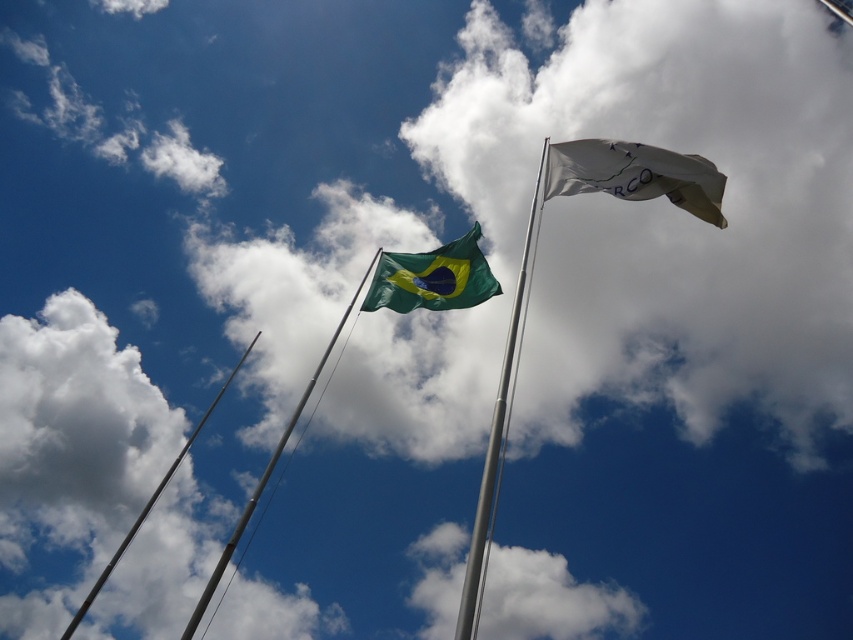
Question: Does white fabric flag at upper right appear over green fabric flag at center?

Choices:
 (A) no
 (B) yes

Answer: (B)

Question: Which is nearer to the metallic silver flag pole at upper center?

Choices:
 (A) white fabric flag at upper right
 (B) green fabric flag pole at upper center
 (C) green fabric flag at center
 (D) silver metallic flag pole at center

Answer: (B)

Question: Which of these objects is positioned closest to the green fabric flag pole at upper center?

Choices:
 (A) silver metallic flag pole at center
 (B) metallic silver flag pole at upper center

Answer: (B)

Question: Does green fabric flag at center appear on the right side of silver metallic flag pole at center?

Choices:
 (A) no
 (B) yes

Answer: (A)

Question: Considering the real-world distances, which object is closest to the white fabric flag at upper right?

Choices:
 (A) metallic silver flag pole at upper center
 (B) green fabric flag at center

Answer: (B)

Question: Does white fabric flag at upper right appear on the left side of metallic silver flag pole at upper center?

Choices:
 (A) yes
 (B) no

Answer: (B)